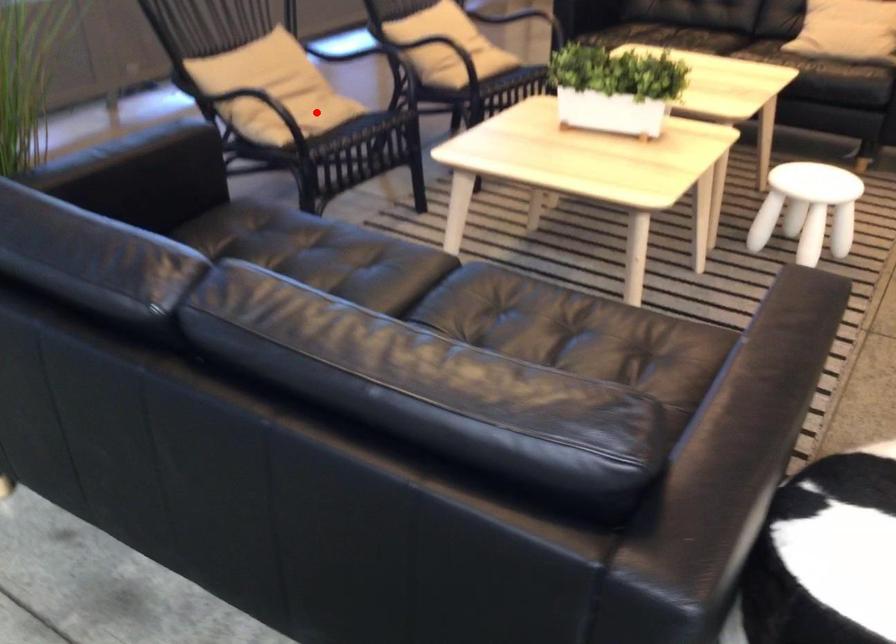
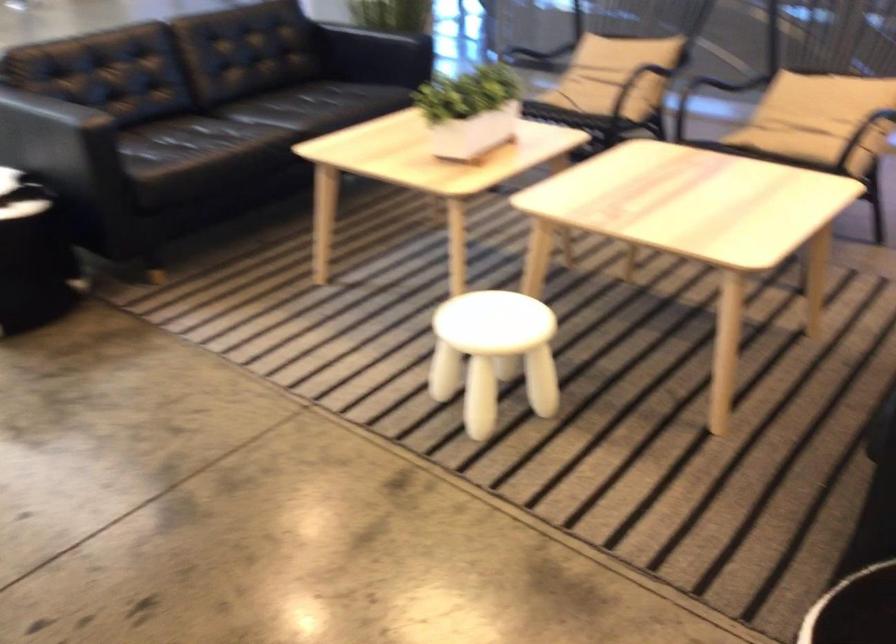
Locate, in the second image, the point that corresponds to the highlighted location in the first image.

(597, 91)